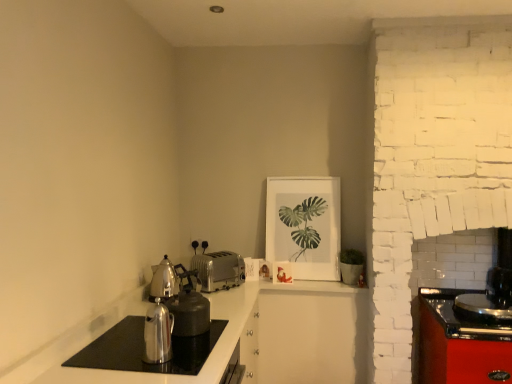
What do you see at coordinates (143, 349) in the screenshot? Image resolution: width=512 pixels, height=384 pixels. I see `polished silver kettle at lower left` at bounding box center [143, 349].

Describe the element at coordinates (304, 225) in the screenshot. I see `matte white picture frame at upper center` at that location.

The image size is (512, 384). What do you see at coordinates (218, 270) in the screenshot? I see `silver metallic toaster at center` at bounding box center [218, 270].

Image resolution: width=512 pixels, height=384 pixels. Find the location of `polished silver kettle at lower left`. polished silver kettle at lower left is located at coordinates (143, 349).

Can you confirm if polished silver kettle at lower left is wider than satin silver teapot at left?

Yes, polished silver kettle at lower left is wider than satin silver teapot at left.

Is polished silver kettle at lower left situated inside satin silver teapot at left or outside?

polished silver kettle at lower left exists outside the volume of satin silver teapot at left.

Could you tell me if polished silver kettle at lower left is facing satin silver teapot at left?

No, polished silver kettle at lower left is not aimed at satin silver teapot at left.

Is point (214, 340) in front of point (152, 267)?

That is True.

Is satin silver teapot at left positioned beyond the bounds of matte white picture frame at upper center?

Yes, satin silver teapot at left is outside of matte white picture frame at upper center.

Locate an element on the screen. Image resolution: width=512 pixels, height=384 pixels. picture frame above the satin silver teapot at left (from a real-world perspective) is located at coordinates (304, 225).

Considering the sizes of objects satin silver teapot at left and matte white picture frame at upper center in the image provided, who is taller, satin silver teapot at left or matte white picture frame at upper center?

Standing taller between the two is matte white picture frame at upper center.

From a real-world perspective, which is physically below, satin silver teapot at left or polished silver kettle at lower left?

polished silver kettle at lower left.

Based on the photo, are satin silver teapot at left and polished silver kettle at lower left making contact?

No, satin silver teapot at left is not next to polished silver kettle at lower left.

Measure the distance between satin silver teapot at left and polished silver kettle at lower left.

21.92 inches.

Consider the image. Is satin silver teapot at left at the left side of polished silver kettle at lower left?

Correct, you'll find satin silver teapot at left to the left of polished silver kettle at lower left.

From the image's perspective, is shiny metallic kettle at lower left located beneath satin silver teapot at left?

Yes, from the image's perspective, shiny metallic kettle at lower left is below satin silver teapot at left.

Between shiny metallic kettle at lower left and satin silver teapot at left, which one has larger size?

With larger size is satin silver teapot at left.

From a real-world perspective, which is physically below, shiny metallic kettle at lower left or satin silver teapot at left?

From a 3D spatial view, shiny metallic kettle at lower left is below.

Is shiny metallic kettle at lower left positioned before satin silver teapot at left?

Yes.

Considering the relative sizes of polished silver kettle at lower left and shiny metallic kettle at lower left in the image provided, is polished silver kettle at lower left shorter than shiny metallic kettle at lower left?

Indeed, polished silver kettle at lower left has a lesser height compared to shiny metallic kettle at lower left.

Locate an element on the screen. home appliance in front of the shiny metallic kettle at lower left is located at coordinates (x=143, y=349).

From the image's perspective, which is below, polished silver kettle at lower left or shiny metallic kettle at lower left?

From the image's view, polished silver kettle at lower left is below.

From the image's perspective, would you say polished silver kettle at lower left is positioned over matte white picture frame at upper center?

No, from the image's perspective, polished silver kettle at lower left is not over matte white picture frame at upper center.

Is polished silver kettle at lower left closer to the viewer compared to matte white picture frame at upper center?

Yes, polished silver kettle at lower left is closer to the camera.

Which of these two, polished silver kettle at lower left or matte white picture frame at upper center, is bigger?

matte white picture frame at upper center is bigger.

Is polished silver kettle at lower left oriented away from matte white picture frame at upper center?

No, polished silver kettle at lower left's orientation is not away from matte white picture frame at upper center.

Is shiny metallic kettle at lower left further to the viewer compared to polished silver kettle at lower left?

Yes, the depth of shiny metallic kettle at lower left is greater than that of polished silver kettle at lower left.

From the image's perspective, who appears lower, shiny metallic kettle at lower left or polished silver kettle at lower left?

polished silver kettle at lower left appears lower in the image.

Would you say shiny metallic kettle at lower left is inside or outside polished silver kettle at lower left?

shiny metallic kettle at lower left is located beyond the bounds of polished silver kettle at lower left.

Considering the sizes of objects shiny metallic kettle at lower left and polished silver kettle at lower left in the image provided, who is thinner, shiny metallic kettle at lower left or polished silver kettle at lower left?

With smaller width is shiny metallic kettle at lower left.

There is a polished silver kettle at lower left. At what (x,y) coordinates should I click in order to perform the action: click on tea pot above it (from a real-world perspective). Please return your answer as a coordinate pair (x, y). This screenshot has width=512, height=384. Looking at the image, I should click on (168, 279).

The image size is (512, 384). In the image, there is a matte white picture frame at upper center. In order to click on tea pot below it (from a real-world perspective) in this screenshot , I will do `click(168, 279)`.

Which object lies nearer to the anchor point satin silver teapot at left, polished silver kettle at lower left or silver metallic toaster at center?

silver metallic toaster at center is closer to satin silver teapot at left.

Which object lies further to the anchor point matte white picture frame at upper center, satin silver teapot at left or silver metallic toaster at center?

The object further to matte white picture frame at upper center is satin silver teapot at left.

From the image, which object appears to be farther from polished silver kettle at lower left, silver metallic toaster at center or shiny metallic kettle at lower left?

silver metallic toaster at center is further to polished silver kettle at lower left.

Based on the photo, which object lies further to the anchor point shiny metallic kettle at lower left, satin silver teapot at left or polished silver kettle at lower left?

satin silver teapot at left lies further to shiny metallic kettle at lower left than the other object.

From the image, which object appears to be farther from polished silver kettle at lower left, matte white picture frame at upper center or silver metallic toaster at center?

The object further to polished silver kettle at lower left is matte white picture frame at upper center.

Which object lies nearer to the anchor point silver metallic toaster at center, satin silver teapot at left or matte white picture frame at upper center?

satin silver teapot at left is closer to silver metallic toaster at center.

Based on their spatial positions, is shiny metallic kettle at lower left or polished silver kettle at lower left further from matte white picture frame at upper center?

shiny metallic kettle at lower left.

Considering their positions, is polished silver kettle at lower left positioned closer to silver metallic toaster at center than shiny metallic kettle at lower left?

polished silver kettle at lower left is closer to silver metallic toaster at center.

The image size is (512, 384). Identify the location of kitchen appliance between polished silver kettle at lower left and silver metallic toaster at center from front to back. (158, 334).

Identify the location of toaster between polished silver kettle at lower left and matte white picture frame at upper center along the z-axis. (218, 270).

Find the location of a particular element. The height and width of the screenshot is (384, 512). tea pot between shiny metallic kettle at lower left and matte white picture frame at upper center in the front-back direction is located at coordinates coord(168,279).

Identify the location of toaster between shiny metallic kettle at lower left and matte white picture frame at upper center along the z-axis. The height and width of the screenshot is (384, 512). (218, 270).